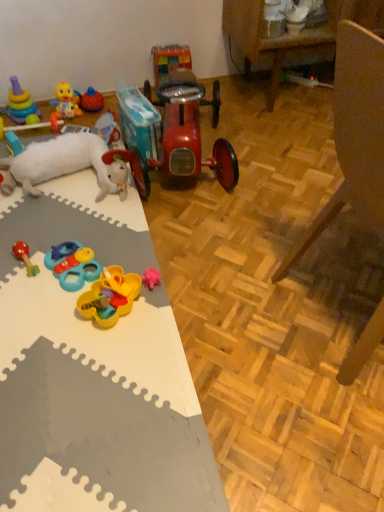
Locate an element on the screen. The image size is (384, 512). empty space that is in between rubberized red and green rattle at lower left, which ranks as the eighth toy in right-to-left order, and rubber duck at left, arranged as the second toy when viewed from the left is located at coordinates (25, 217).